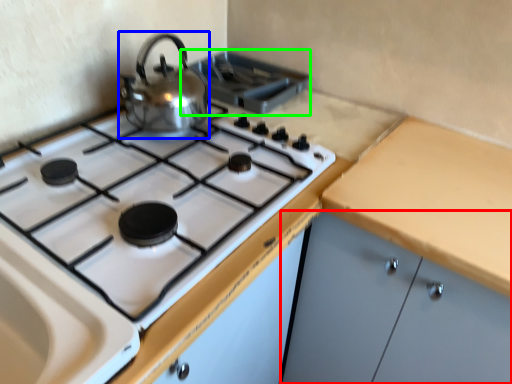
Question: Which object is the farthest from cabinetry (highlighted by a red box)? Choose among these: kitchen appliance (highlighted by a blue box) or appliance (highlighted by a green box).

Choices:
 (A) kitchen appliance
 (B) appliance

Answer: (B)